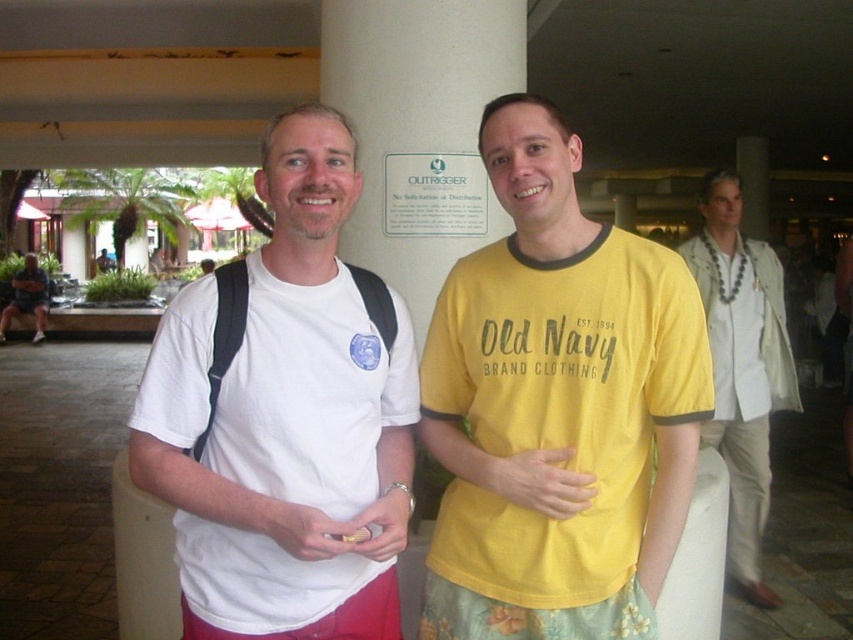
Question: Which point appears closest to the camera in this image?

Choices:
 (A) (607, 468)
 (B) (386, 214)

Answer: (A)

Question: Is yellow cotton shirt at center to the left of white smooth pillar at center from the viewer's perspective?

Choices:
 (A) yes
 (B) no

Answer: (B)

Question: Which point is closer to the camera?

Choices:
 (A) (614, 353)
 (B) (515, 29)
 (C) (706, 301)

Answer: (A)

Question: Which point is closer to the camera?

Choices:
 (A) gray fabric shirt at right
 (B) white matte t-shirt at center

Answer: (B)

Question: Does white matte t-shirt at center appear on the left side of white smooth pillar at center?

Choices:
 (A) yes
 (B) no

Answer: (A)

Question: Can you confirm if yellow cotton shirt at center is positioned below gray fabric shirt at right?

Choices:
 (A) yes
 (B) no

Answer: (B)